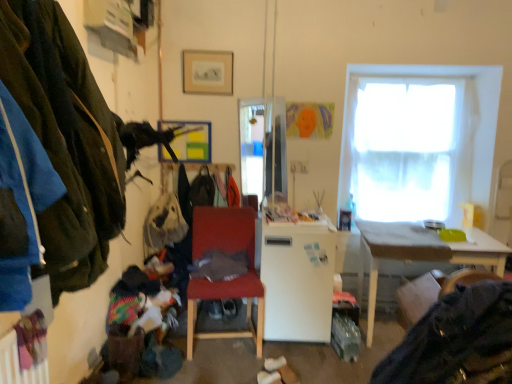
Question: Is metallic silver picture frame at upper center, which is the second picture frame from top to bottom, inside the boundaries of velvet-like brown swivel chair at lower right, or outside?

Choices:
 (A) inside
 (B) outside

Answer: (B)

Question: Is metallic silver picture frame at upper center, which is the second picture frame from top to bottom, taller or shorter than velvet-like brown swivel chair at lower right?

Choices:
 (A) short
 (B) tall

Answer: (B)

Question: Estimate the real-world distances between objects in this image. Which object is closer to the matte white desk at right?

Choices:
 (A) dark gray fabric at lower right, which is the second clothing from top to bottom
 (B) white matte refrigerator at center
 (C) matte gold picture frame at upper center, the 1th picture frame from the top
 (D) metallic silver picture frame at upper center, which is the second picture frame from top to bottom
 (E) velvet green jacket at left, the second clothing positioned from the bottom

Answer: (B)

Question: Which of these objects is positioned farthest from the matte white desk at right?

Choices:
 (A) white sheer curtain at upper right
 (B) matte red chair at center
 (C) metallic silver picture frame at upper center, acting as the first picture frame starting from the back
 (D) dark gray fabric at lower right, the 1th clothing positioned from the right
 (E) velvet green jacket at left, the second clothing positioned from the bottom

Answer: (E)